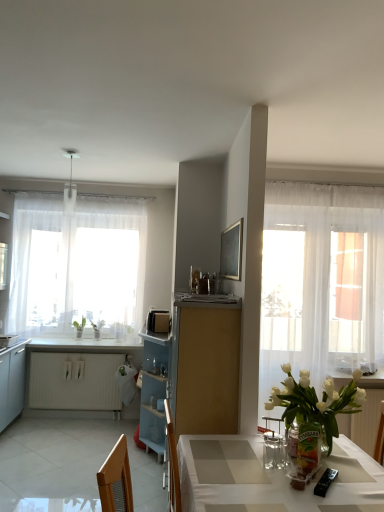
This screenshot has height=512, width=384. Find the location of `free space to the right of transparent glass vase at center-right`. free space to the right of transparent glass vase at center-right is located at coordinates point(359,468).